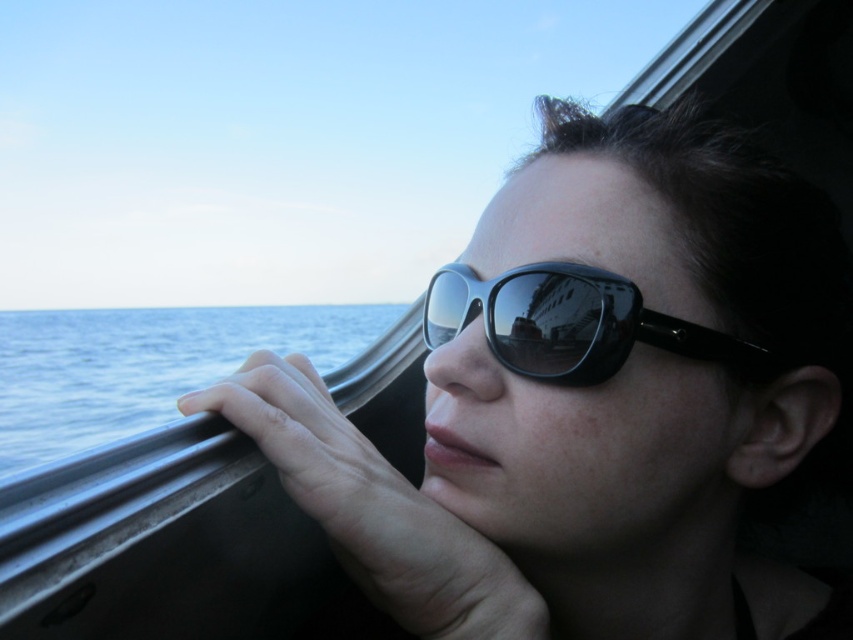
Is point (86, 410) positioned before point (773, 369)?

No, (86, 410) is behind (773, 369).

Is the position of blue water at left more distant than that of black shiny sunglasses at center?

No, it is in front of black shiny sunglasses at center.

This screenshot has height=640, width=853. I want to click on blue water at left, so click(x=144, y=365).

At what (x,y) coordinates should I click in order to perform the action: click on blue water at left. Please return your answer as a coordinate pair (x, y). Looking at the image, I should click on (144, 365).